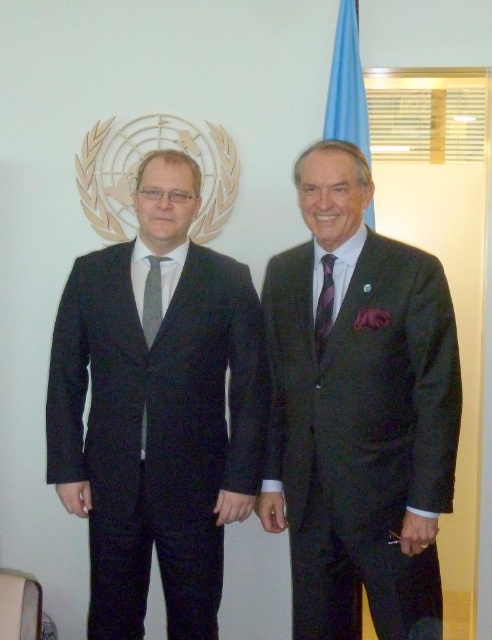
You are a photographer who needs to adjust the lighting for a UN event photo. The scene includes two individuals in formal attire. The person on the left is wearing a dark suit with a white shirt and a gray tie, and the person on the right is in a dark suit with a white shirt and a patterned tie and pocket square. You notice a point at coordinates [360,413] on the image. According to the scene description, which part of the clothing does this point correspond to?

The point at coordinates [360,413] corresponds to the dark grey textured suit at right.

You are a photographer analyzing the image. You need to focus on the gray textured tie at left. What are its coordinates in the image?

The gray textured tie at left is located at coordinates (153, 300).